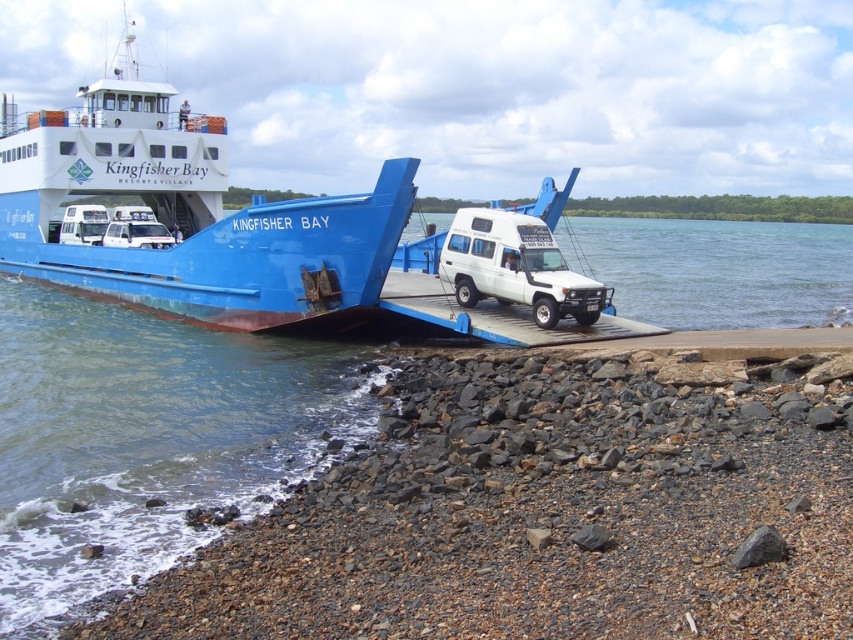
You are a passenger on the ferry named Kingfisher Bay. You want to know if you can safely walk from the blue matte ferry at center to the shore without getting wet. Based on the scene, can you determine if the white glossy water at center is below or above the ferry deck?

The blue matte ferry at center has a greater height compared to the white glossy water at center, so the water is below the ferry deck. Therefore, you can safely walk from the ferry to the shore without getting wet.

You are a delivery driver who needs to load your white matte truck at center onto the blue matte ferry at center. The ferry has a height restriction of 3 meters. Can you determine if your truck will fit based on the information provided?

The blue matte ferry at center is much taller than the white matte truck at center, so the truck will fit under the ferry height restriction.